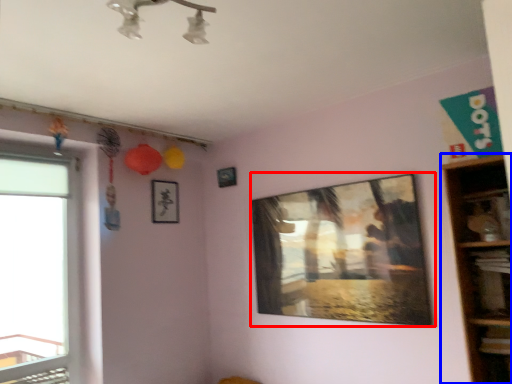
Question: Which point is further to the camera, picture frame (highlighted by a red box) or shelf (highlighted by a blue box)?

Choices:
 (A) picture frame
 (B) shelf

Answer: (A)